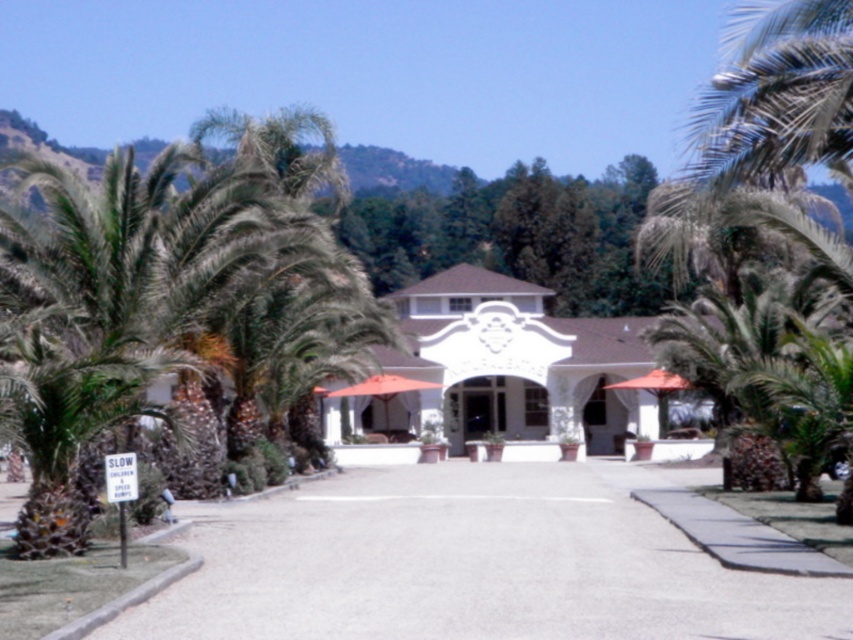
Question: Does white stucco building at center appear over green leafy palm tree at right?

Choices:
 (A) no
 (B) yes

Answer: (A)

Question: Which object appears farthest from the camera in this image?

Choices:
 (A) gray gravel road at lower left
 (B) white stucco building at center
 (C) green leafy palm tree at right

Answer: (B)

Question: Is white stucco building at center below green leafy palm tree at right?

Choices:
 (A) yes
 (B) no

Answer: (A)

Question: Does gray gravel road at lower left have a larger size compared to white stucco building at center?

Choices:
 (A) no
 (B) yes

Answer: (A)

Question: Which point is farther to the camera?

Choices:
 (A) (761, 42)
 (B) (561, 412)

Answer: (B)

Question: Which object is positioned closest to the white stucco building at center?

Choices:
 (A) green leafy palm tree at right
 (B) gray gravel road at lower left

Answer: (A)